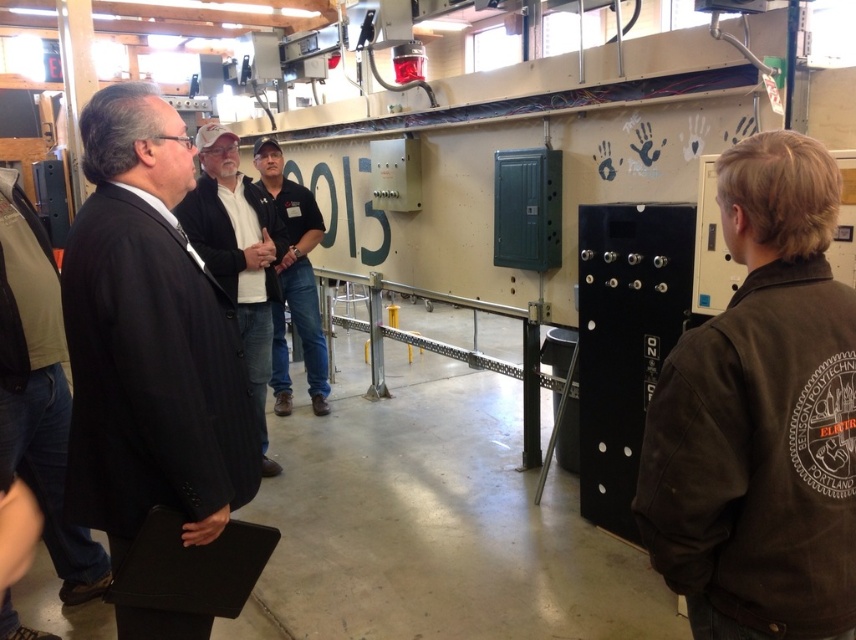
Is point (163, 326) farther from camera compared to point (88, 596)?

No.

Measure the distance between black pinstripe suit at left and dark suit at left.

black pinstripe suit at left and dark suit at left are 35.75 inches apart from each other.

Where is `black pinstripe suit at left`? The width and height of the screenshot is (856, 640). black pinstripe suit at left is located at coordinates (149, 339).

Identify the location of black pinstripe suit at left. (149, 339).

Consider the image. Is black pinstripe suit at left wider than dark gray suit at center?

Yes.

Is black pinstripe suit at left smaller than dark gray suit at center?

Indeed, black pinstripe suit at left has a smaller size compared to dark gray suit at center.

Is point (143, 513) closer to camera compared to point (265, 296)?

That is True.

In order to click on black pinstripe suit at left in this screenshot , I will do `click(149, 339)`.

Is black pinstripe suit at left to the left of black denim jeans at center from the viewer's perspective?

Incorrect, black pinstripe suit at left is not on the left side of black denim jeans at center.

Which of these two, black pinstripe suit at left or black denim jeans at center, stands taller?

With more height is black denim jeans at center.

Is point (97, 116) closer to camera compared to point (293, 308)?

Yes, point (97, 116) is in front of point (293, 308).

The image size is (856, 640). Identify the location of black pinstripe suit at left. tap(149, 339).